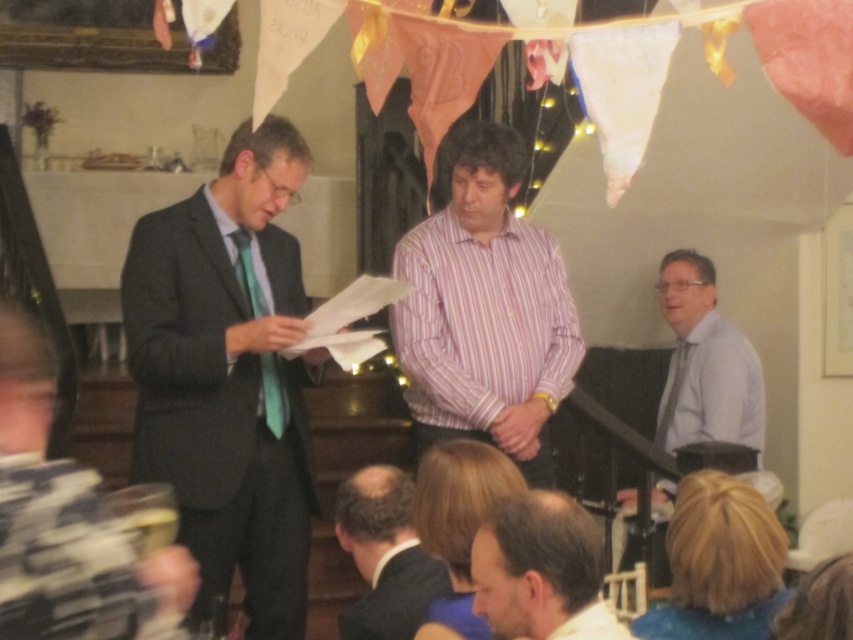
Between point (67, 561) and point (277, 438), which one is positioned in front?

Point (67, 561) is more forward.

Does matte black suit at left have a greater width compared to green silk tie at center?

Yes, matte black suit at left is wider than green silk tie at center.

Who is more distant from viewer, (119,592) or (242,291)?

Point (242,291)

The width and height of the screenshot is (853, 640). Find the location of `matte black suit at left`. matte black suit at left is located at coordinates (67, 524).

Does dark gray suit at left have a larger size compared to green silk tie at center?

Yes, dark gray suit at left is bigger than green silk tie at center.

Which is behind, point (245, 403) or point (260, 381)?

Point (260, 381)

In order to click on dark gray suit at left in this screenshot , I will do `click(228, 374)`.

Between point (270, 368) and point (683, 342), which one is positioned in front?

Point (270, 368) is more forward.

Is point (270, 408) closer to camera compared to point (664, 420)?

That is True.

Measure the distance between point (x=236, y=244) and camera.

They are 3.63 meters apart.

You are a GUI agent. You are given a task and a screenshot of the screen. Output one action in this format:
    pyautogui.click(x=<x>, y=<y>)
    Task: Click on the green silk tie at center
    Image resolution: width=853 pixels, height=640 pixels.
    Given the screenshot: What is the action you would take?
    pyautogui.click(x=273, y=394)